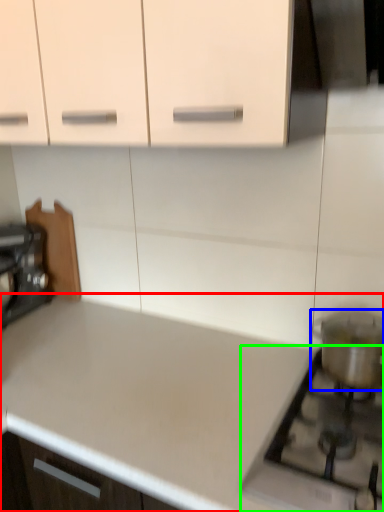
Question: Which is farther away from countertop (highlighted by a red box)? appliance (highlighted by a blue box) or gas stove (highlighted by a green box)?

Choices:
 (A) appliance
 (B) gas stove

Answer: (A)